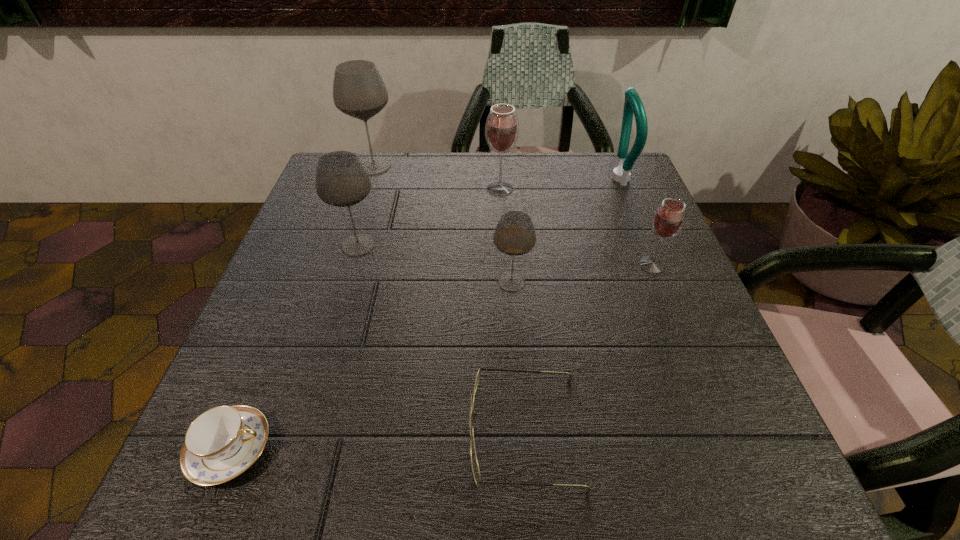
Image resolution: width=960 pixels, height=540 pixels. Find the location of `teacup`. teacup is located at coordinates (x=221, y=443).

Locate an element on the screen. Image resolution: width=960 pixels, height=540 pixels. beige spectacles is located at coordinates (474, 462).

Locate an element on the screen. Image resolution: width=960 pixels, height=540 pixels. free space located 0.340m on the right of the farthest gray wineglass is located at coordinates (526, 166).

In order to click on vacant space situated at the jaws of the green bottle opener in this screenshot , I will do `click(543, 178)`.

The height and width of the screenshot is (540, 960). I want to click on vacant space positioned at the jaws of the green bottle opener, so click(x=489, y=178).

The image size is (960, 540). In order to click on free region located 0.380m at the jaws of the green bottle opener in this screenshot , I will do `click(457, 178)`.

At what (x,y) coordinates should I click in order to perform the action: click on free space located on the right of the left red wineglass. Please return your answer as a coordinate pair (x, y). Image resolution: width=960 pixels, height=540 pixels. Looking at the image, I should click on (612, 188).

Where is `vacant area situated 0.350m on the front of the second biggest gray wineglass`? This screenshot has width=960, height=540. vacant area situated 0.350m on the front of the second biggest gray wineglass is located at coordinates (306, 420).

Identify the location of vacant space located on the right of the smallest gray wineglass. This screenshot has height=540, width=960. (623, 282).

Where is `free space located on the left of the smaller red wineglass`? This screenshot has height=540, width=960. free space located on the left of the smaller red wineglass is located at coordinates (476, 265).